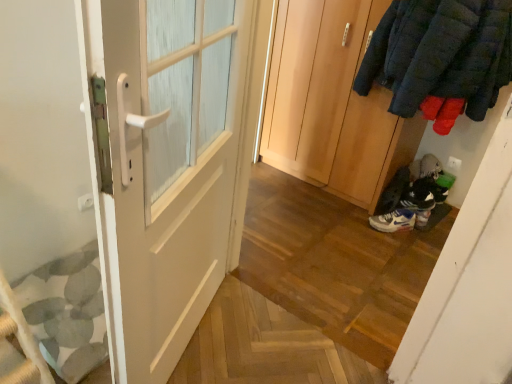
This screenshot has width=512, height=384. I want to click on vacant area that lies to the right of white matte door at left, which ranks as the second door in back-to-front order, so click(256, 348).